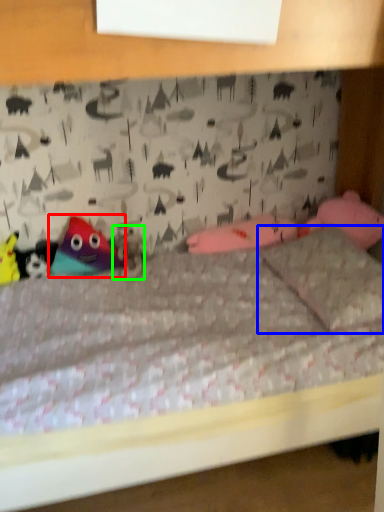
Question: Estimate the real-world distances between objects in this image. Which object is closer to toy (highlighted by a red box), pillow (highlighted by a blue box) or animal (highlighted by a green box)?

Choices:
 (A) pillow
 (B) animal

Answer: (B)